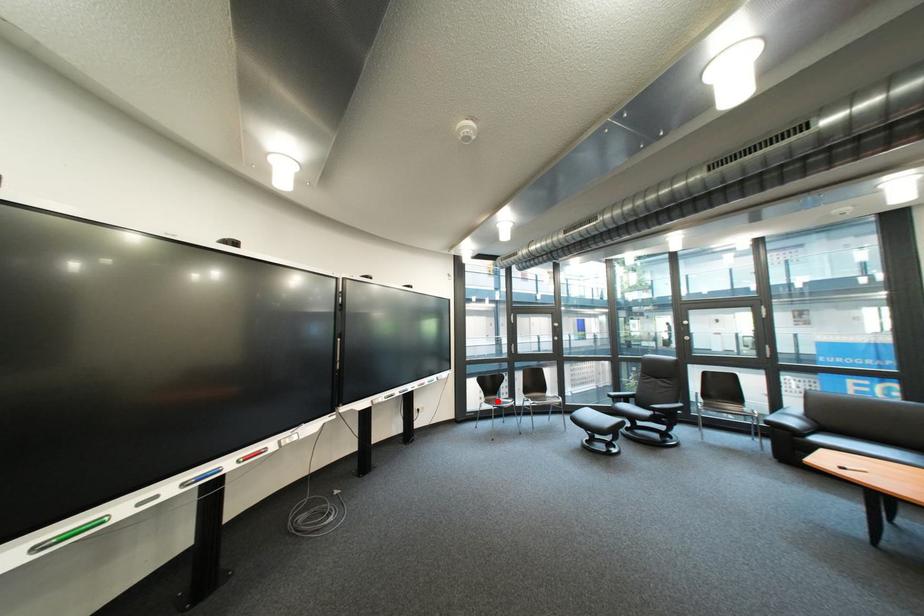
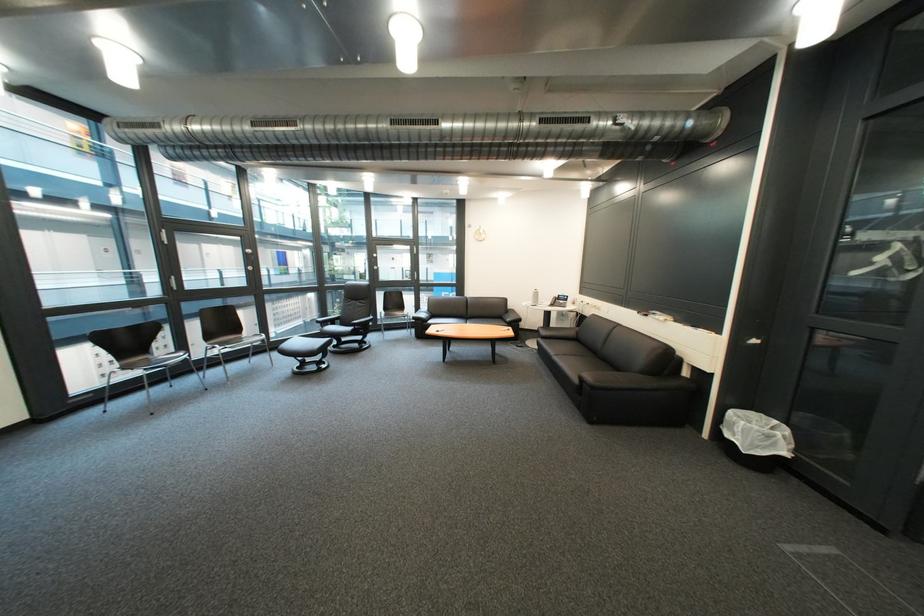
In the second image, find the point that corresponds to the highlighted location in the first image.

(131, 368)